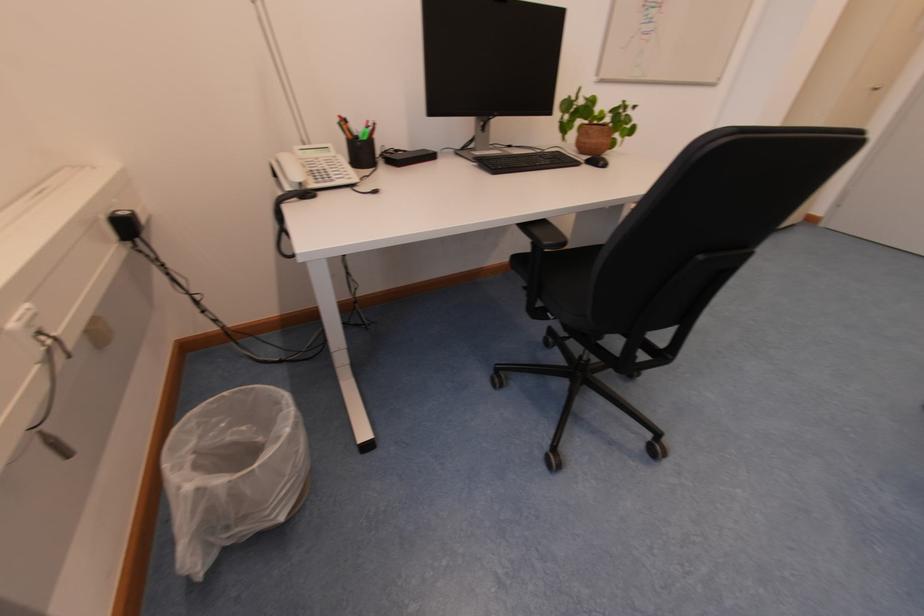
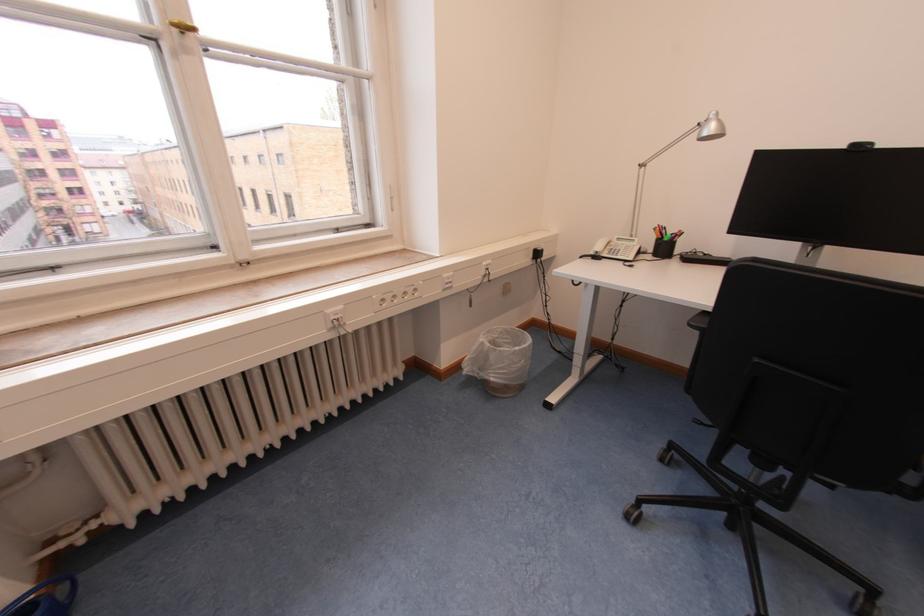
Find the pixel in the second image that matches [296,437] in the first image.

(524, 353)